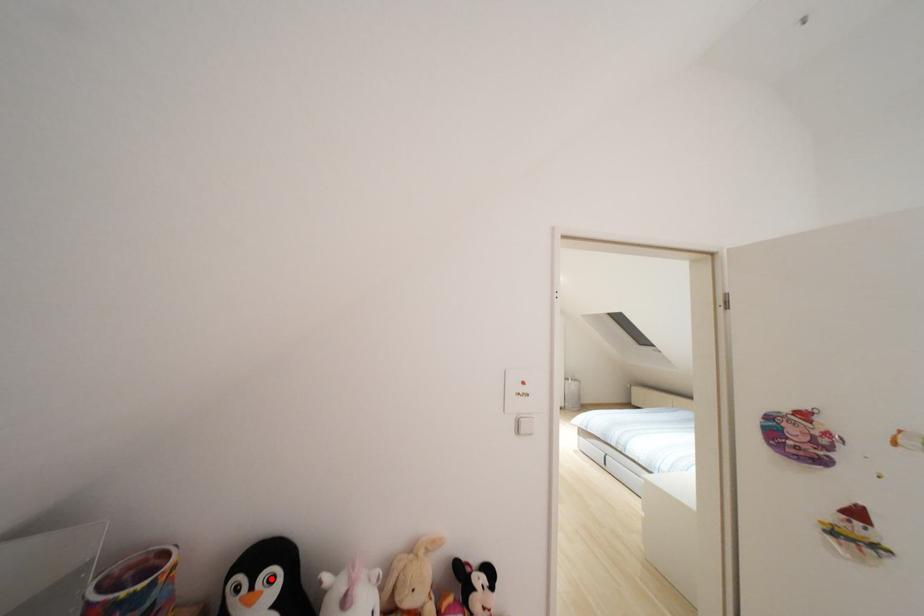
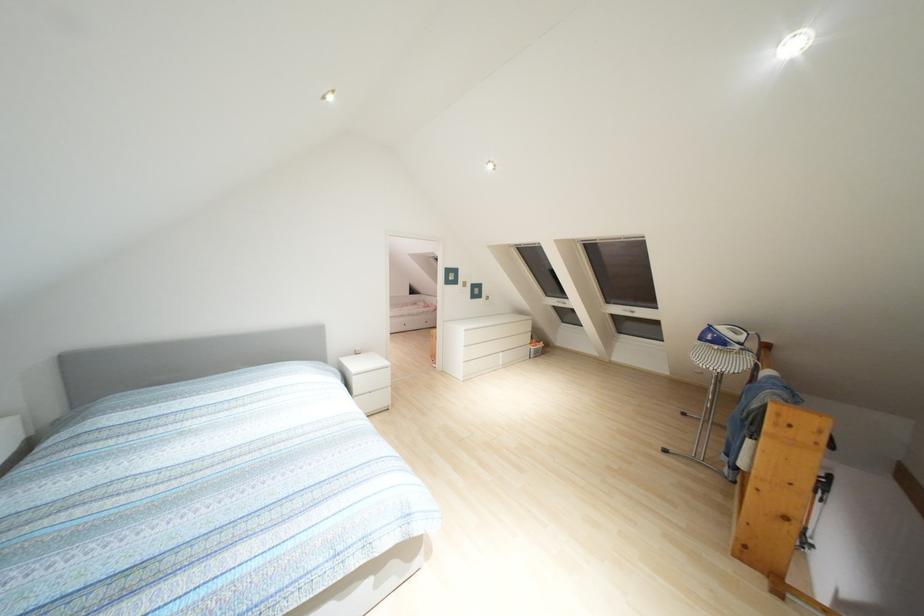
Question: I am providing you with two images of the same scene from different viewpoints. A red point is marked on the first image. At the location where the point appears in image 1, is it still visible in image 2?

Choices:
 (A) Yes
 (B) No

Answer: (B)